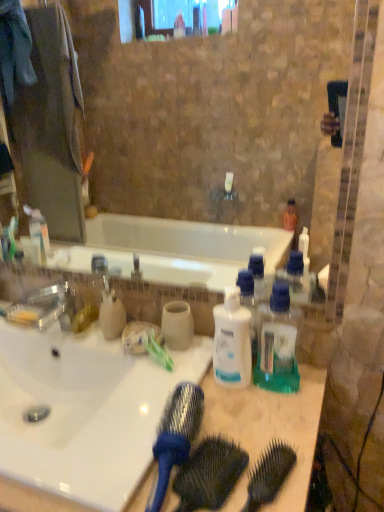
Where is `free space that is in between blue plastic comb at center and translucent green plastic at center, the 1th bottle positioned from the right`? free space that is in between blue plastic comb at center and translucent green plastic at center, the 1th bottle positioned from the right is located at coordinates (256, 425).